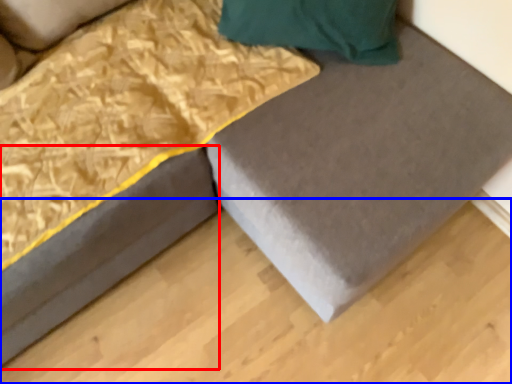
Question: Among these objects, which one is nearest to the camera, bed frame (highlighted by a red box) or plywood (highlighted by a blue box)?

Choices:
 (A) bed frame
 (B) plywood

Answer: (A)